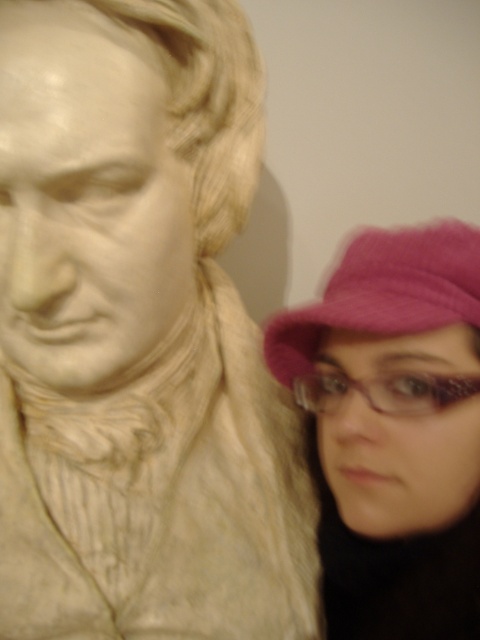
You are an interior designer trying to arrange a gallery wall. You have a white marble bust at upper left and a pink fuzzy hat at right. If you want to ensure both items are visible without overlapping, which item should you place closer to the center?

The white marble bust at upper left should be placed closer to the center because it occupies less space than the pink fuzzy hat at right, allowing both items to be visible without overlapping.